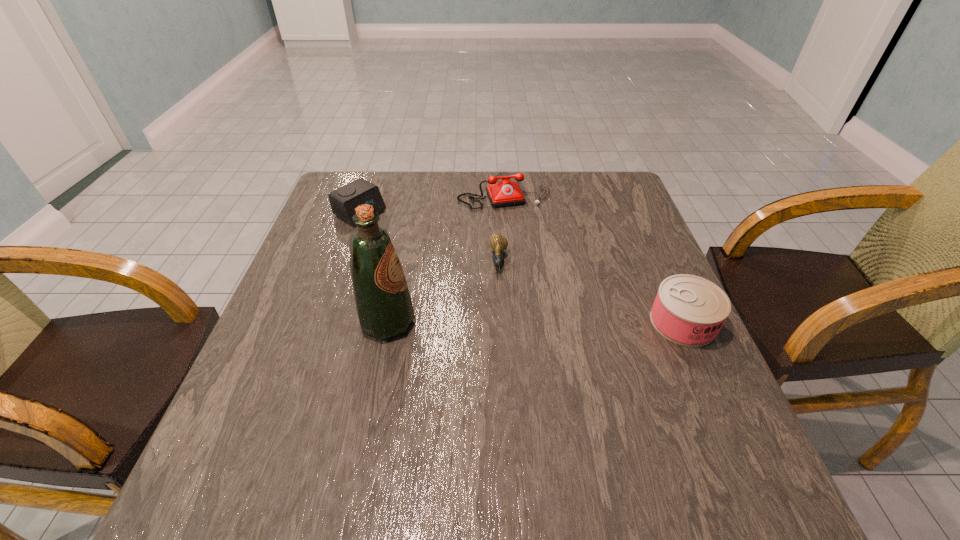
Where is `empty location between the alarm clock and the third farthest object`? empty location between the alarm clock and the third farthest object is located at coordinates (429, 237).

What are the coordinates of `vacant point located between the rightmost object and the telephone` in the screenshot? It's located at (593, 257).

The height and width of the screenshot is (540, 960). Identify the location of vacant area that lies between the shortest object and the leftmost object. (429, 237).

Where is `vacant space in between the rightmost object and the second object from left to right`? The image size is (960, 540). vacant space in between the rightmost object and the second object from left to right is located at coordinates 536,322.

The height and width of the screenshot is (540, 960). I want to click on vacant point located between the tallest object and the can, so click(x=536, y=322).

The image size is (960, 540). Find the location of `empty space between the can and the telephone`. empty space between the can and the telephone is located at coordinates (593, 257).

Identify the location of free space between the third farthest object and the alarm clock. The width and height of the screenshot is (960, 540). (429, 237).

Identify the location of object that is the closest one to the shortest object. Image resolution: width=960 pixels, height=540 pixels. (504, 193).

Locate which object ranks second in proximity to the third farthest object. Please provide its 2D coordinates. Your answer should be formatted as a tuple, i.e. [(x, y)], where the tuple contains the x and y coordinates of a point satisfying the conditions above.

[(383, 304)]

Locate an element on the screen. free location that satisfies the following two spatial constraints: 1. on the front side of the leftmost object; 2. on the right side of the can is located at coordinates (323, 322).